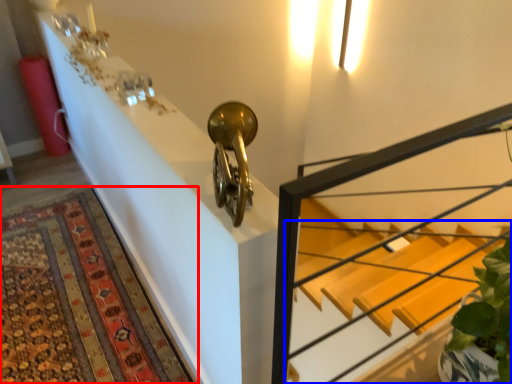
Question: Among these objects, which one is nearest to the camera, mat (highlighted by a red box) or stairs (highlighted by a blue box)?

Choices:
 (A) mat
 (B) stairs

Answer: (B)